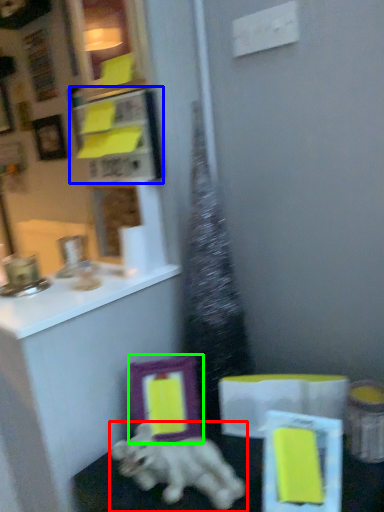
Question: Which object is the farthest from dog (highlighted by a red box)? Choose among these: cabinet (highlighted by a blue box) or picture frame (highlighted by a green box).

Choices:
 (A) cabinet
 (B) picture frame

Answer: (A)